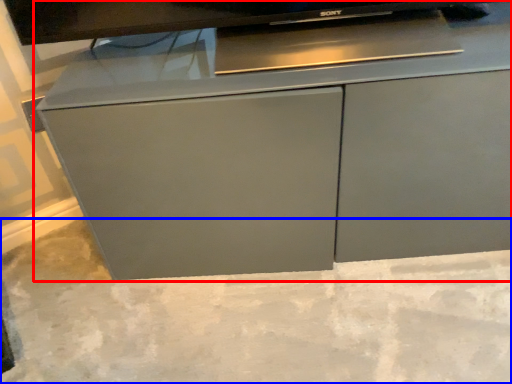
Question: Which of the following is the farthest to the observer, cabinetry (highlighted by a red box) or concrete (highlighted by a blue box)?

Choices:
 (A) cabinetry
 (B) concrete

Answer: (A)